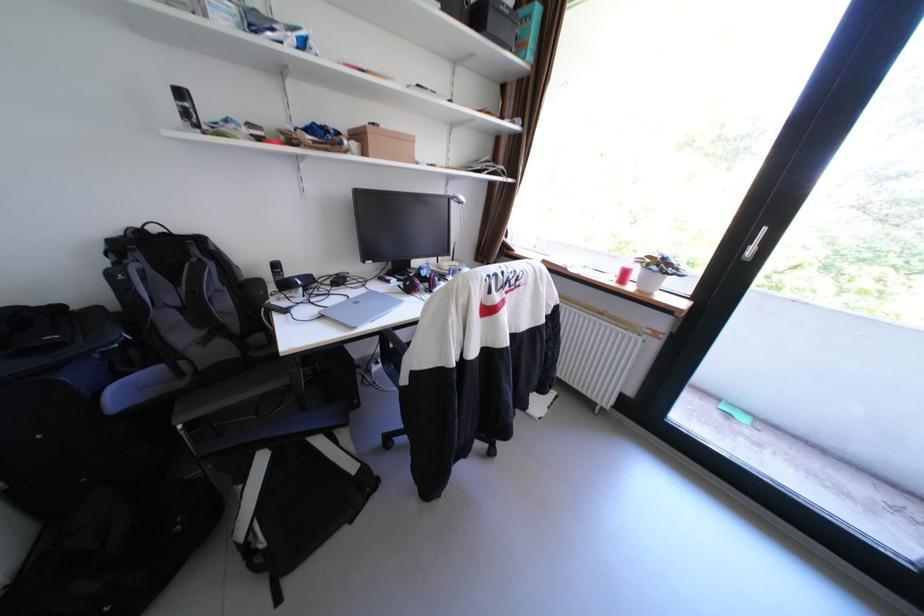
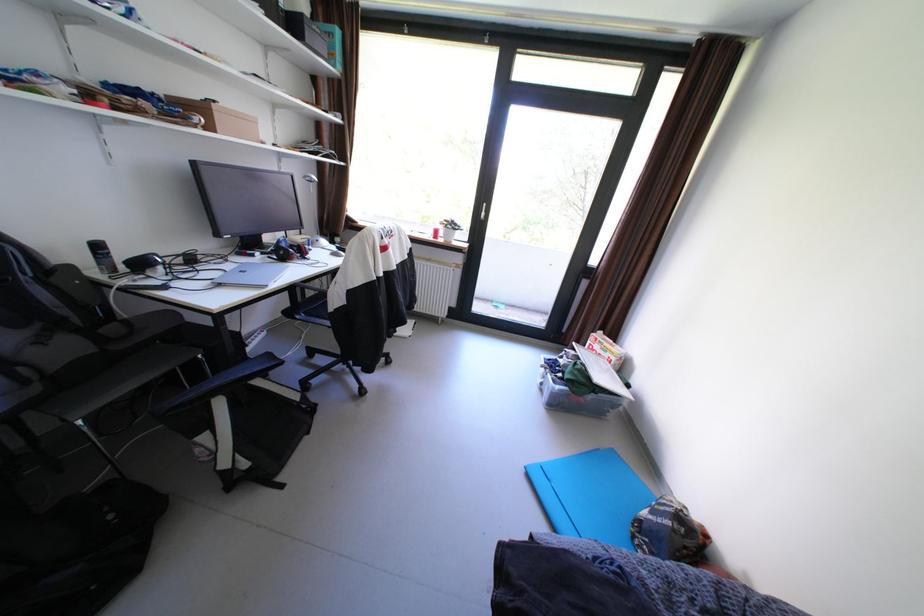
Locate, in the second image, the point that corresponds to pixel 409 281 in the first image.

(274, 254)